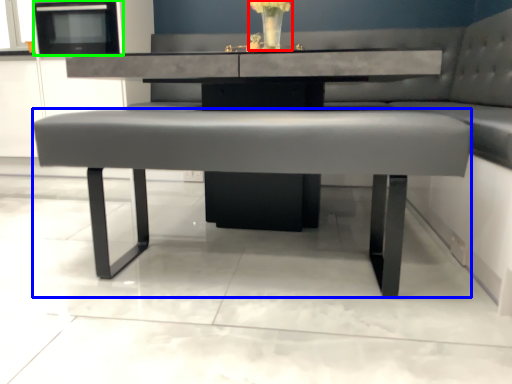
Question: Estimate the real-world distances between objects in this image. Which object is closer to floral arrangement (highlighted by a red box), coffee table (highlighted by a blue box) or appliance (highlighted by a green box)?

Choices:
 (A) coffee table
 (B) appliance

Answer: (A)